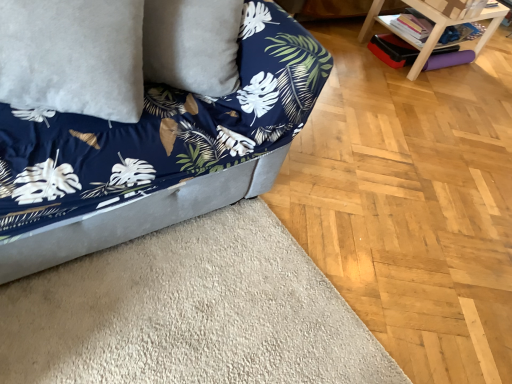
Measure the distance between white fluffy pillow at upper left and camera.

white fluffy pillow at upper left and camera are 3.54 feet apart from each other.

The height and width of the screenshot is (384, 512). Identify the location of velvet blue couch at lower left. 152,151.

This screenshot has width=512, height=384. What are the coordinates of `wooden table at upper right` in the screenshot? It's located at (448, 25).

Where is `white fluffy pillow at upper left`? The image size is (512, 384). white fluffy pillow at upper left is located at coordinates (73, 56).

Does velvet blue couch at lower left have a greater height compared to wooden table at upper right?

Yes, velvet blue couch at lower left is taller than wooden table at upper right.

From a real-world perspective, relative to wooden table at upper right, is velvet blue couch at lower left vertically above or below?

In terms of real-world spatial position, velvet blue couch at lower left is above wooden table at upper right.

Can you confirm if velvet blue couch at lower left is wider than wooden table at upper right?

Correct, the width of velvet blue couch at lower left exceeds that of wooden table at upper right.

Which is correct: velvet blue couch at lower left is inside wooden table at upper right, or outside of it?

velvet blue couch at lower left cannot be found inside wooden table at upper right.

Which point is more forward, (426, 14) or (150, 113)?

The point (150, 113) is closer.

Can you tell me how much wooden table at upper right and velvet blue couch at lower left differ in facing direction?

wooden table at upper right and velvet blue couch at lower left are facing 4 degrees away from each other.

From a real-world perspective, is wooden table at upper right located beneath velvet blue couch at lower left?

Yes, from a real-world perspective, wooden table at upper right is under velvet blue couch at lower left.

Is wooden table at upper right oriented towards velvet blue couch at lower left?

No, wooden table at upper right is not oriented towards velvet blue couch at lower left.

From a real-world perspective, is velvet blue couch at lower left above or below white fluffy pillow at upper left?

Clearly, from a real-world perspective, velvet blue couch at lower left is below white fluffy pillow at upper left.

In terms of size, does velvet blue couch at lower left appear bigger or smaller than white fluffy pillow at upper left?

velvet blue couch at lower left is bigger than white fluffy pillow at upper left.

In the image, there is a white fluffy pillow at upper left. Where is `studio couch below it (from the image's perspective)`? studio couch below it (from the image's perspective) is located at coordinates click(152, 151).

Considering the sizes of objects velvet blue couch at lower left and white fluffy pillow at upper left in the image provided, who is shorter, velvet blue couch at lower left or white fluffy pillow at upper left?

With less height is white fluffy pillow at upper left.

Considering the sizes of objects white fluffy pillow at upper left and wooden table at upper right in the image provided, who is thinner, white fluffy pillow at upper left or wooden table at upper right?

white fluffy pillow at upper left.

From a real-world perspective, who is located lower, white fluffy pillow at upper left or wooden table at upper right?

wooden table at upper right is physically lower.

Is white fluffy pillow at upper left in front of wooden table at upper right?

Yes, it is.

Can you confirm if white fluffy pillow at upper left is smaller than wooden table at upper right?

Yes.

From a real-world perspective, is white fluffy pillow at upper left located beneath velvet blue couch at lower left?

No, from a real-world perspective, white fluffy pillow at upper left is not under velvet blue couch at lower left.

Considering the relative sizes of white fluffy pillow at upper left and velvet blue couch at lower left in the image provided, is white fluffy pillow at upper left bigger than velvet blue couch at lower left?

No, white fluffy pillow at upper left is not bigger than velvet blue couch at lower left.

How much distance is there between white fluffy pillow at upper left and velvet blue couch at lower left?

white fluffy pillow at upper left is 10.60 inches from velvet blue couch at lower left.

Choose the correct answer: Is white fluffy pillow at upper left inside velvet blue couch at lower left or outside it?

white fluffy pillow at upper left lies within the bounds of velvet blue couch at lower left.

Consider the image. From a real-world perspective, is wooden table at upper right physically located above or below white fluffy pillow at upper left?

Clearly, from a real-world perspective, wooden table at upper right is below white fluffy pillow at upper left.

Is wooden table at upper right further to the viewer compared to white fluffy pillow at upper left?

Yes, it is.

Looking at this image, measure the distance from wooden table at upper right to white fluffy pillow at upper left.

2.38 meters.

Based on the photo, which object is thinner, wooden table at upper right or white fluffy pillow at upper left?

white fluffy pillow at upper left.

The height and width of the screenshot is (384, 512). Find the location of `table above the velvet blue couch at lower left (from the image's perspective)`. table above the velvet blue couch at lower left (from the image's perspective) is located at coordinates (448, 25).

The image size is (512, 384). I want to click on table on the right of velvet blue couch at lower left, so [448, 25].

When comparing their distances from wooden table at upper right, does white fluffy pillow at upper left or velvet blue couch at lower left seem further?

white fluffy pillow at upper left lies further to wooden table at upper right than the other object.

Looking at the image, which one is located further to velvet blue couch at lower left, wooden table at upper right or white fluffy pillow at upper left?

The object further to velvet blue couch at lower left is wooden table at upper right.

When comparing their distances from wooden table at upper right, does velvet blue couch at lower left or white fluffy pillow at upper left seem closer?

velvet blue couch at lower left is positioned closer to the anchor wooden table at upper right.

Looking at this image, when comparing their distances from velvet blue couch at lower left, does white fluffy pillow at upper left or wooden table at upper right seem closer?

white fluffy pillow at upper left lies closer to velvet blue couch at lower left than the other object.

Looking at the image, which one is located closer to white fluffy pillow at upper left, wooden table at upper right or velvet blue couch at lower left?

Among the two, velvet blue couch at lower left is located nearer to white fluffy pillow at upper left.

When comparing their distances from white fluffy pillow at upper left, does velvet blue couch at lower left or wooden table at upper right seem further?

wooden table at upper right.

What are the coordinates of `pillow between velvet blue couch at lower left and wooden table at upper right from front to back` in the screenshot? It's located at (73, 56).